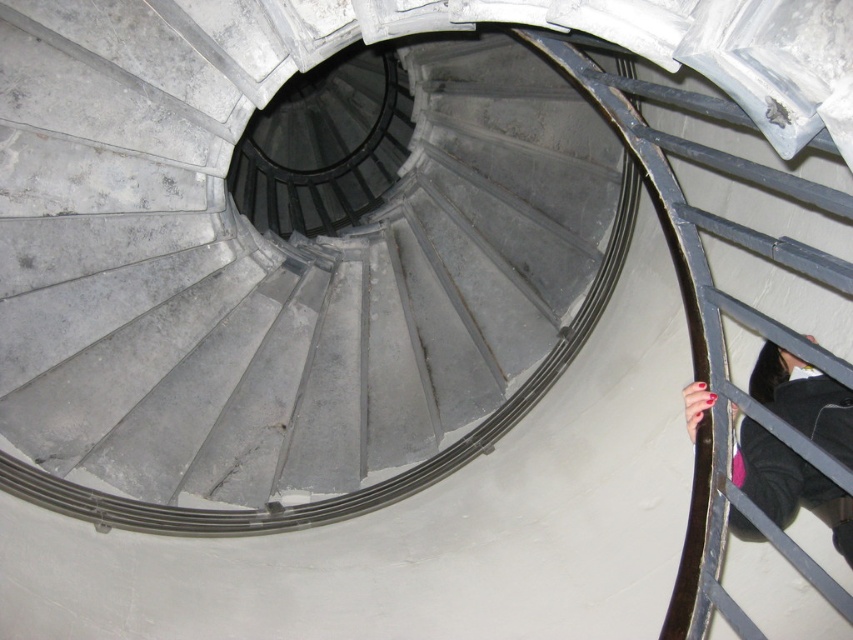
You are standing on the gray concrete spiral staircase at center and want to reach the dark gray fabric hand at lower right. Can you step down to it directly?

The gray concrete spiral staircase at center is located above the dark gray fabric hand at lower right, so you cannot step down to it directly because it is below you.

You are standing on the landing above the gray concrete spiral staircase at center. You want to throw a small ball down to someone standing at the base of the staircase. Considering the staircase is 3.49 meters away from you, will the ball land near the base?

The gray concrete spiral staircase at center is 3.49 meters away from the camera. Since you are standing on the landing above, the ball will land near the base of the gray concrete spiral staircase at center if thrown straight down, as the distance is measured from your position to the staircase.